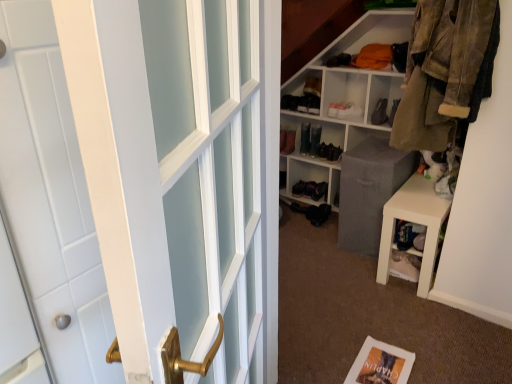
This screenshot has width=512, height=384. I want to click on vacant area to the left of white matte stool at lower right, so click(x=334, y=269).